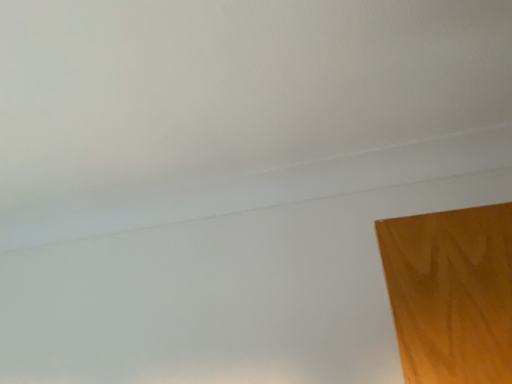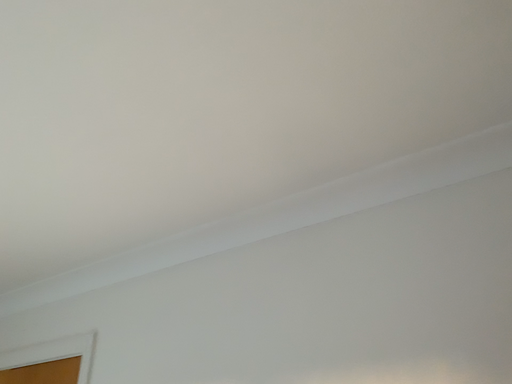
Question: How did the camera likely rotate when shooting the video?

Choices:
 (A) rotated right
 (B) rotated left

Answer: (B)